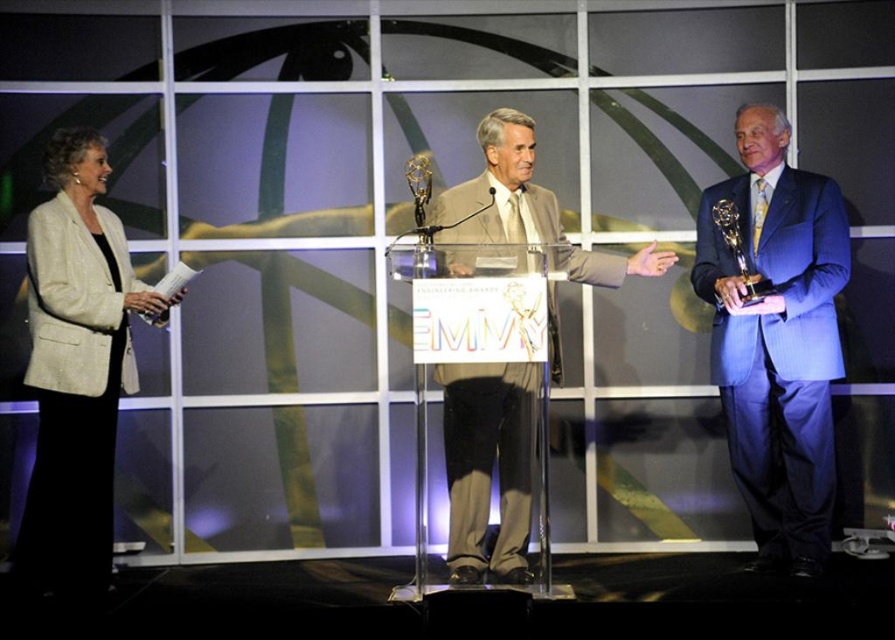
Question: Does light beige fabric jacket at left appear on the left side of light beige fabric suit at center?

Choices:
 (A) yes
 (B) no

Answer: (A)

Question: Which point appears closest to the camera in this image?

Choices:
 (A) (769, 170)
 (B) (467, 378)
 (C) (81, 451)

Answer: (B)

Question: Is blue pinstripe suit at right bigger than light beige fabric suit at center?

Choices:
 (A) yes
 (B) no

Answer: (B)

Question: Is blue pinstripe suit at right further to camera compared to light beige fabric suit at center?

Choices:
 (A) yes
 (B) no

Answer: (A)

Question: Which point is farther to the camera?

Choices:
 (A) light beige fabric jacket at left
 (B) blue pinstripe suit at right
 (C) light beige fabric suit at center

Answer: (B)

Question: Which point is closer to the camera?

Choices:
 (A) (61, 516)
 (B) (445, 195)

Answer: (A)